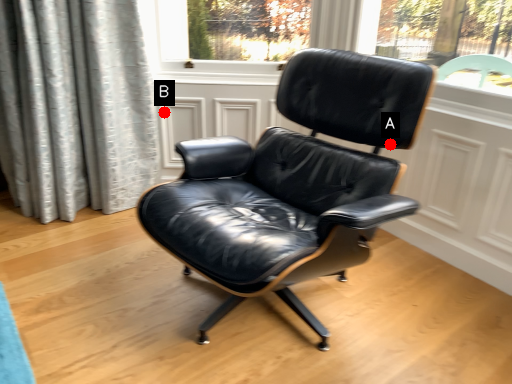
Question: Two points are circled on the image, labeled by A and B beside each circle. Which of the following is the closest to the observer?

Choices:
 (A) A is closer
 (B) B is closer

Answer: (A)